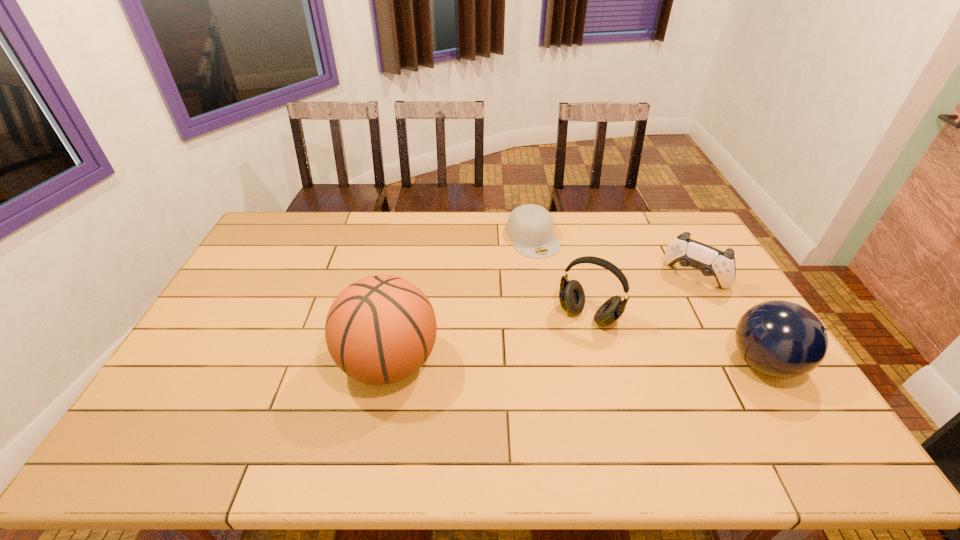
Locate an element on the screen. bowling ball present at the near edge is located at coordinates (781, 339).

Where is `bowling ball at the right edge`? bowling ball at the right edge is located at coordinates (781, 339).

At what (x,y) coordinates should I click in order to perform the action: click on control located in the right edge section of the desktop. Please return your answer as a coordinate pair (x, y). This screenshot has width=960, height=540. Looking at the image, I should click on (710, 261).

You are a GUI agent. You are given a task and a screenshot of the screen. Output one action in this format:
    pyautogui.click(x=<x>, y=<y>)
    Task: Click on the object that is at the near right corner
    Image resolution: width=960 pixels, height=540 pixels.
    Given the screenshot: What is the action you would take?
    coord(781,339)

You are a GUI agent. You are given a task and a screenshot of the screen. Output one action in this format:
    pyautogui.click(x=<x>, y=<y>)
    Task: Click on the vacant region at the far edge of the desktop
    The height and width of the screenshot is (540, 960).
    Given the screenshot: What is the action you would take?
    pyautogui.click(x=319, y=236)

Locate an element on the screen. free space at the near edge of the desktop is located at coordinates (544, 399).

In the image, there is a desktop. At what (x,y) coordinates should I click in order to perform the action: click on blank space at the left edge. Please return your answer as a coordinate pair (x, y). Looking at the image, I should click on (237, 296).

In the image, there is a desktop. Where is `vacant region at the right edge`? Image resolution: width=960 pixels, height=540 pixels. vacant region at the right edge is located at coordinates (734, 316).

Find the location of a particular element. vacant space at the far left corner of the desktop is located at coordinates (255, 246).

Where is `empty space between the headset and the cap`? empty space between the headset and the cap is located at coordinates (561, 276).